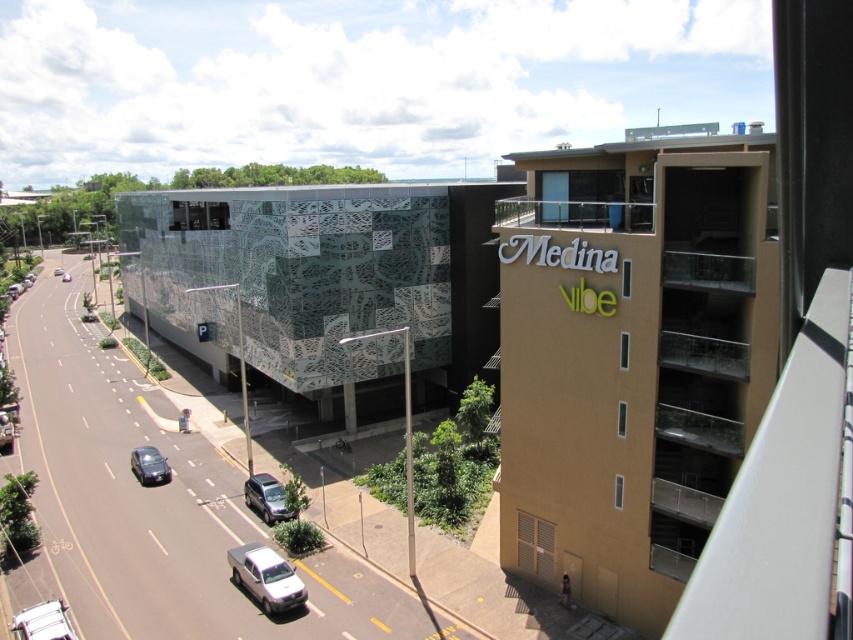
Question: Which object is positioned farthest from the metallic silver suv at center?

Choices:
 (A) shiny black car at center-left
 (B) silver metallic car at center

Answer: (B)

Question: Which of these objects is positioned farthest from the metallic silver suv at center?

Choices:
 (A) matte black car at center
 (B) silver metallic car at center

Answer: (B)

Question: Is silver metallic pickup truck at lower center to the left of metallic silver suv at center from the viewer's perspective?

Choices:
 (A) yes
 (B) no

Answer: (B)

Question: Which point is closer to the camera?

Choices:
 (A) (68, 280)
 (B) (262, 570)
 (C) (155, 452)

Answer: (B)

Question: Does white matte car at lower left have a larger size compared to silver metallic car at center?

Choices:
 (A) no
 (B) yes

Answer: (A)

Question: Does metallic silver suv at center have a lesser width compared to matte black car at center?

Choices:
 (A) yes
 (B) no

Answer: (A)